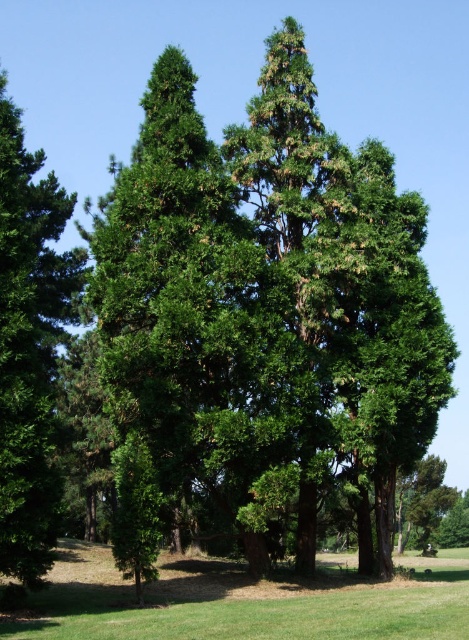
You are a hiker trying to decide between two paths. One path leads behind the green leafy tree at center, and the other leads behind the green leafy tree at left. Which path would be more shaded? Please explain your reasoning based on the trees.

The path behind the green leafy tree at center would be more shaded because the tree is bigger than the green leafy tree at left, providing more coverage and thus more shade.

You are standing in the middle of a grassy field and see a green leafy tree at center and a green grassy field at lower center. Which object is higher from the ground?

The green leafy tree at center is above the green grassy field at lower center, so the tree is higher from the ground.